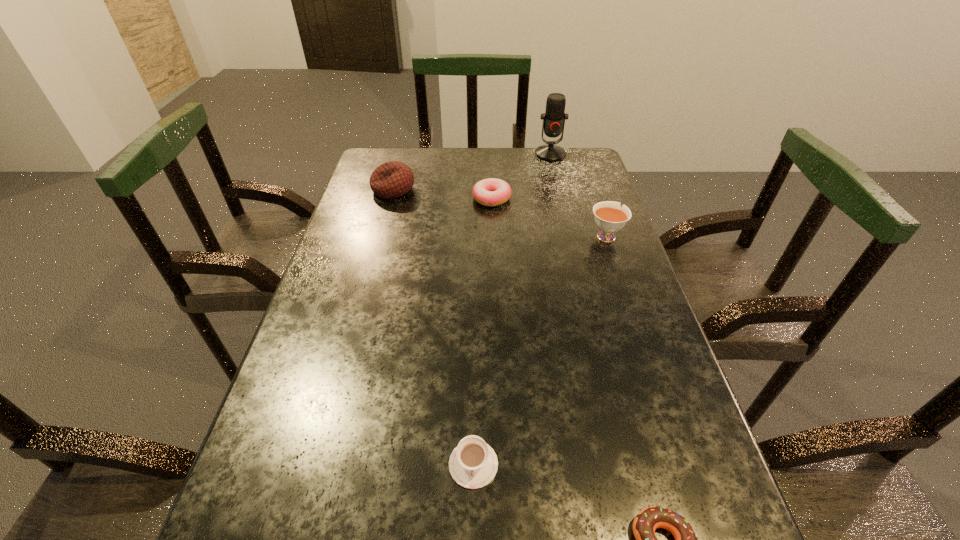
The image size is (960, 540). I want to click on microphone, so click(554, 117).

Identify the location of the tallest object. Image resolution: width=960 pixels, height=540 pixels. (554, 117).

The image size is (960, 540). I want to click on the right teacup, so click(x=610, y=217).

The height and width of the screenshot is (540, 960). Identify the location of the fourth farthest object. (610, 217).

Where is `beanbag`? This screenshot has width=960, height=540. beanbag is located at coordinates (393, 179).

Locate an element on the screen. the left doughnut is located at coordinates (490, 192).

Where is `the left teacup`? the left teacup is located at coordinates (473, 464).

The height and width of the screenshot is (540, 960). Find the location of `the nearer teacup`. the nearer teacup is located at coordinates (473, 464).

Find the location of a particular element. The image size is (960, 540). free point located 0.160m on the side of the tallest object with the red ring is located at coordinates (559, 188).

Locate an element on the screen. This screenshot has height=540, width=960. vacant area situated on the side of the fourth farthest object with the handle is located at coordinates tap(585, 173).